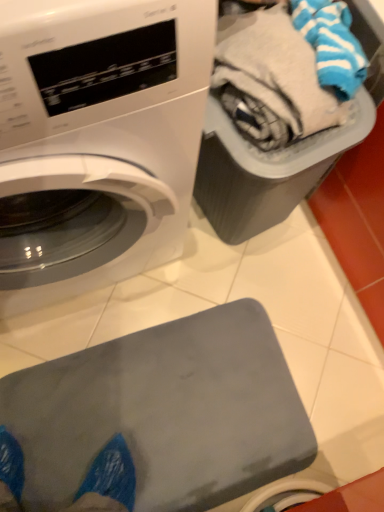
What is the approximate width of plastic gray bin at upper right?

The width of plastic gray bin at upper right is 14.27 inches.

Find the location of a particular element. gray rubber mat at lower center is located at coordinates (164, 412).

This screenshot has height=512, width=384. I want to click on white glossy washing machine at upper left, so click(x=102, y=128).

The width and height of the screenshot is (384, 512). What are the coordinates of `plastic gray bin at upper right` in the screenshot? It's located at (266, 170).

How distant is white glossy washing machine at upper left from plastic gray bin at upper right?

white glossy washing machine at upper left and plastic gray bin at upper right are 10.22 inches apart from each other.

From the image's perspective, would you say white glossy washing machine at upper left is shown under plastic gray bin at upper right?

Yes, from the image's perspective, white glossy washing machine at upper left is below plastic gray bin at upper right.

Considering the relative sizes of white glossy washing machine at upper left and plastic gray bin at upper right in the image provided, is white glossy washing machine at upper left taller than plastic gray bin at upper right?

Yes.

Is white glossy washing machine at upper left spatially inside plastic gray bin at upper right, or outside of it?

white glossy washing machine at upper left exists outside the volume of plastic gray bin at upper right.

How different are the orientations of plastic gray bin at upper right and gray rubber mat at lower center in degrees?

The angular difference between plastic gray bin at upper right and gray rubber mat at lower center is 104 degrees.

From a real-world perspective, between plastic gray bin at upper right and gray rubber mat at lower center, who is vertically lower?

gray rubber mat at lower center, from a real-world perspective.

Consider the image. Is plastic gray bin at upper right to the right of gray rubber mat at lower center from the viewer's perspective?

Indeed, plastic gray bin at upper right is positioned on the right side of gray rubber mat at lower center.

Can you confirm if plastic gray bin at upper right is thinner than gray rubber mat at lower center?

Correct, the width of plastic gray bin at upper right is less than that of gray rubber mat at lower center.

How distant is white glossy washing machine at upper left from gray rubber mat at lower center?

white glossy washing machine at upper left and gray rubber mat at lower center are 16.79 inches apart from each other.

This screenshot has height=512, width=384. I want to click on washing machine above the gray rubber mat at lower center (from a real-world perspective), so click(x=102, y=128).

Does point (129, 44) appear closer or farther from the camera than point (222, 488)?

Clearly, point (129, 44) is closer to the camera than point (222, 488).

Is white glossy washing machine at upper left not inside gray rubber mat at lower center?

white glossy washing machine at upper left is positioned outside gray rubber mat at lower center.

Does gray rubber mat at lower center have a lesser height compared to white glossy washing machine at upper left?

Yes, gray rubber mat at lower center is shorter than white glossy washing machine at upper left.

Considering the relative positions of gray rubber mat at lower center and white glossy washing machine at upper left in the image provided, is gray rubber mat at lower center to the left or to the right of white glossy washing machine at upper left?

gray rubber mat at lower center is to the right of white glossy washing machine at upper left.

This screenshot has width=384, height=512. I want to click on appliance lying below the white glossy washing machine at upper left (from the image's perspective), so click(x=164, y=412).

Is gray rubber mat at lower center next to white glossy washing machine at upper left?

No, gray rubber mat at lower center is not with white glossy washing machine at upper left.

Is plastic gray bin at upper right far from white glossy washing machine at upper left?

Actually, plastic gray bin at upper right and white glossy washing machine at upper left are a little close together.

Is plastic gray bin at upper right oriented away from white glossy washing machine at upper left?

No, plastic gray bin at upper right's orientation is not away from white glossy washing machine at upper left.

Can you confirm if plastic gray bin at upper right is positioned to the right of white glossy washing machine at upper left?

Yes, plastic gray bin at upper right is to the right of white glossy washing machine at upper left.

Consider the image. How different are the orientations of plastic gray bin at upper right and white glossy washing machine at upper left in degrees?

8.17 degrees.

Considering the sizes of objects gray rubber mat at lower center and plastic gray bin at upper right in the image provided, who is shorter, gray rubber mat at lower center or plastic gray bin at upper right?

With less height is gray rubber mat at lower center.

From a real-world perspective, does gray rubber mat at lower center sit lower than plastic gray bin at upper right?

Yes, from a real-world perspective, gray rubber mat at lower center is beneath plastic gray bin at upper right.

Are gray rubber mat at lower center and plastic gray bin at upper right far apart?

No, gray rubber mat at lower center is in close proximity to plastic gray bin at upper right.

Considering the positions of point (280, 464) and point (338, 148), is point (280, 464) closer or farther from the camera than point (338, 148)?

Point (280, 464) is positioned farther from the camera compared to point (338, 148).

In order to click on washing machine on the left of plastic gray bin at upper right in this screenshot , I will do `click(102, 128)`.

What are the coordinates of `garbage that appears in front of the gray rubber mat at lower center` in the screenshot? It's located at (266, 170).

Estimate the real-world distances between objects in this image. Which object is further from gray rubber mat at lower center, plastic gray bin at upper right or white glossy washing machine at upper left?

Based on the image, plastic gray bin at upper right appears to be further to gray rubber mat at lower center.

Estimate the real-world distances between objects in this image. Which object is further from white glossy washing machine at upper left, gray rubber mat at lower center or plastic gray bin at upper right?

The object further to white glossy washing machine at upper left is gray rubber mat at lower center.

When comparing their distances from white glossy washing machine at upper left, does plastic gray bin at upper right or gray rubber mat at lower center seem closer?

The object closer to white glossy washing machine at upper left is plastic gray bin at upper right.

Looking at the image, which one is located closer to gray rubber mat at lower center, white glossy washing machine at upper left or plastic gray bin at upper right?

Based on the image, white glossy washing machine at upper left appears to be nearer to gray rubber mat at lower center.

Estimate the real-world distances between objects in this image. Which object is further from plastic gray bin at upper right, white glossy washing machine at upper left or gray rubber mat at lower center?

Based on the image, gray rubber mat at lower center appears to be further to plastic gray bin at upper right.

Based on their spatial positions, is gray rubber mat at lower center or white glossy washing machine at upper left closer to plastic gray bin at upper right?

white glossy washing machine at upper left.

I want to click on washing machine between plastic gray bin at upper right and gray rubber mat at lower center in the vertical direction, so click(x=102, y=128).